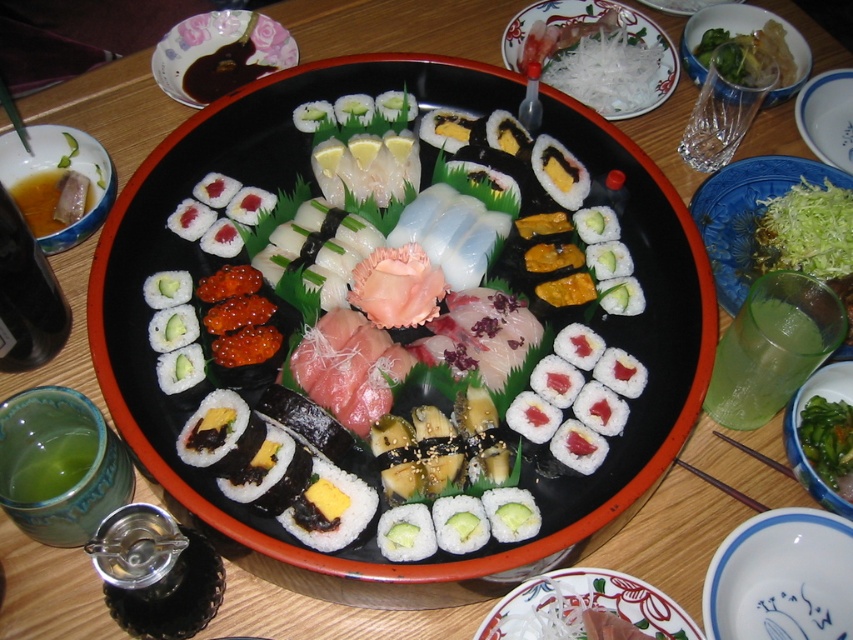
Question: Which of the following is the closest to the observer?

Choices:
 (A) green leafy vegetable at right
 (B) clear glass bowl at upper right
 (C) green leafy vegetable at center

Answer: (C)

Question: In this image, where is white rice with nori at center located relative to shiny black bowl at upper left?

Choices:
 (A) above
 (B) below

Answer: (B)

Question: Observing the image, what is the correct spatial positioning of white ceramic bowl at lower right in reference to white shredded vegetable at upper center?

Choices:
 (A) right
 (B) left

Answer: (A)

Question: Which object appears closest to the camera in this image?

Choices:
 (A) white rice with nori at center
 (B) green leafy vegetable at right

Answer: (A)

Question: Among these objects, which one is farthest from the camera?

Choices:
 (A) white ceramic plate at upper right
 (B) clear glass bowl at upper right

Answer: (A)

Question: Does white shredded vegetable at upper center come behind green leafy vegetable at center?

Choices:
 (A) yes
 (B) no

Answer: (A)